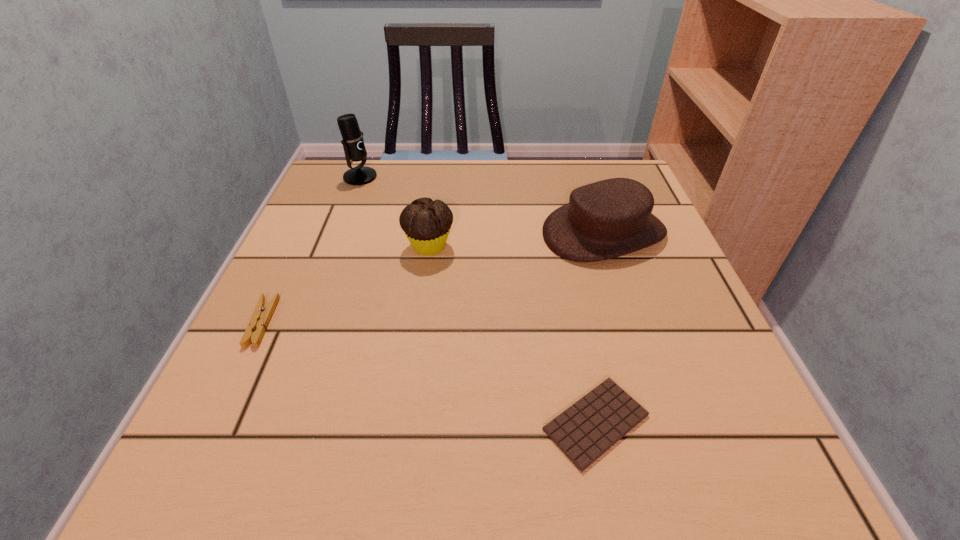
At what (x,y) coordinates should I click in order to perform the action: click on free space located 0.370m on the left of the hat. Please return your answer as a coordinate pair (x, y). The height and width of the screenshot is (540, 960). Looking at the image, I should click on (366, 232).

You are a GUI agent. You are given a task and a screenshot of the screen. Output one action in this format:
    pyautogui.click(x=<x>, y=<y>)
    Task: Click on the vacant space positioned on the front of the clothespin
    The image size is (960, 540).
    Given the screenshot: What is the action you would take?
    pyautogui.click(x=206, y=438)

The height and width of the screenshot is (540, 960). What are the coordinates of `vacant space located on the left of the shortest object` in the screenshot? It's located at (505, 422).

You are a GUI agent. You are given a task and a screenshot of the screen. Output one action in this format:
    pyautogui.click(x=<x>, y=<y>)
    Task: Click on the microphone positioned at the far edge
    This screenshot has width=960, height=540.
    Given the screenshot: What is the action you would take?
    pyautogui.click(x=353, y=143)

Where is `hat that is at the far edge`? This screenshot has height=540, width=960. hat that is at the far edge is located at coordinates (610, 218).

Image resolution: width=960 pixels, height=540 pixels. Identify the location of object that is at the near edge. (586, 430).

The width and height of the screenshot is (960, 540). I want to click on microphone located in the left edge section of the desktop, so click(353, 143).

The height and width of the screenshot is (540, 960). I want to click on clothespin that is at the left edge, so click(261, 316).

The width and height of the screenshot is (960, 540). Identify the location of hat that is positioned at the right edge. (610, 218).

What are the coordinates of `chocolate bar that is at the right edge` in the screenshot? It's located at (586, 430).